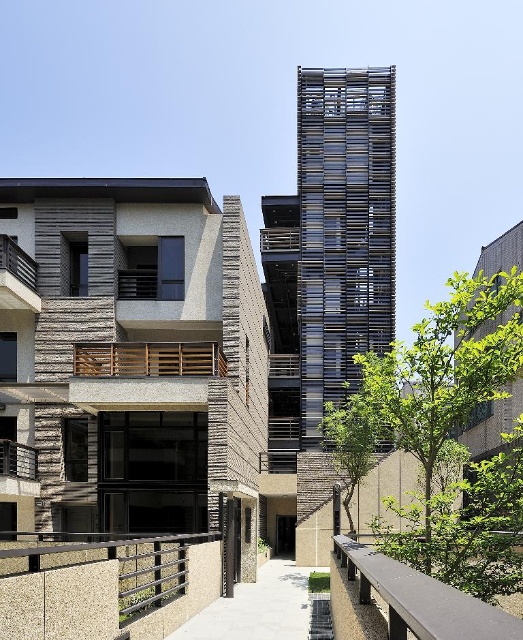
Question: Which object appears closest to the camera in this image?

Choices:
 (A) smooth gray balustrade at lower center
 (B) metallic textured railing at lower center

Answer: (A)

Question: Is smooth gray balustrade at lower center below metallic textured railing at lower center?

Choices:
 (A) yes
 (B) no

Answer: (B)

Question: Which point is closer to the camera?

Choices:
 (A) (198, 540)
 (B) (403, 628)

Answer: (B)

Question: Estimate the real-world distances between objects in this image. Which object is farther from the smooth gray balustrade at lower center?

Choices:
 (A) wooden slats balcony at left
 (B) green leafy tree at center

Answer: (A)

Question: Is metallic textured railing at lower center smaller than wooden slats at center?

Choices:
 (A) yes
 (B) no

Answer: (B)

Question: Considering the relative positions of smooth gray balustrade at lower center and wooden slats balcony at left in the image provided, where is smooth gray balustrade at lower center located with respect to wooden slats balcony at left?

Choices:
 (A) right
 (B) left

Answer: (A)